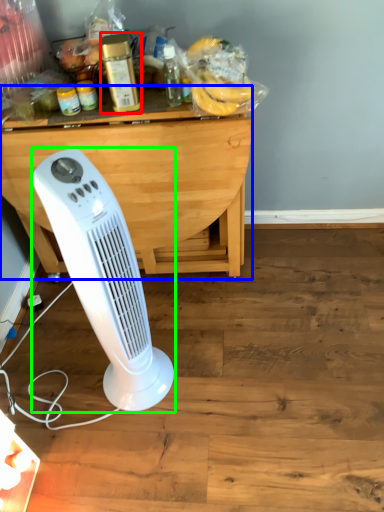
Question: Which is farther away from bottle (highlighted by a red box)? table (highlighted by a blue box) or home appliance (highlighted by a green box)?

Choices:
 (A) table
 (B) home appliance

Answer: (B)